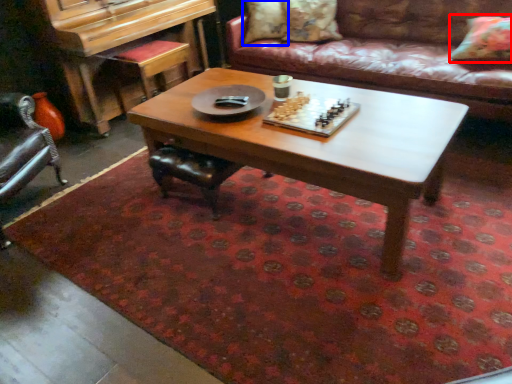
Question: Which point is further to the camera, pillow (highlighted by a red box) or pillow (highlighted by a blue box)?

Choices:
 (A) pillow
 (B) pillow

Answer: (B)